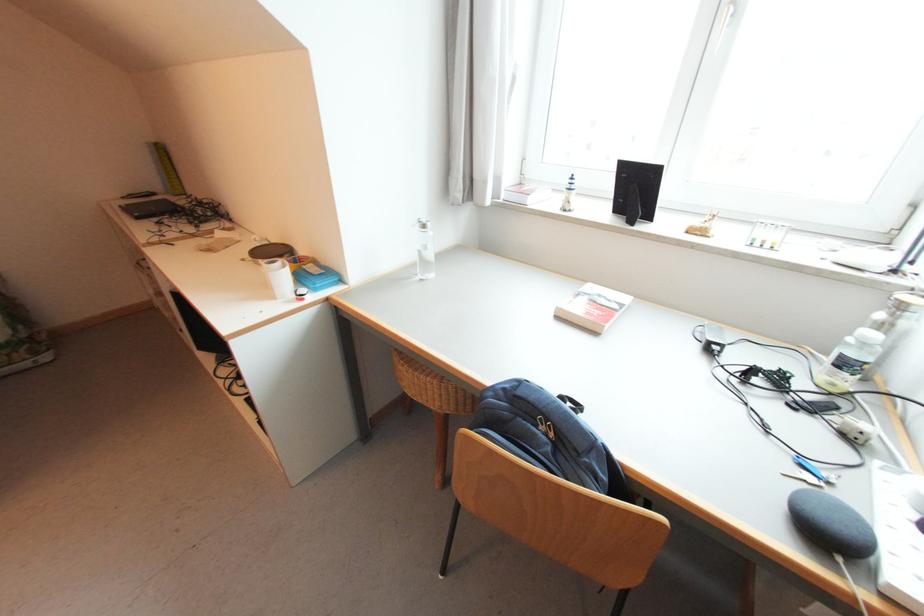
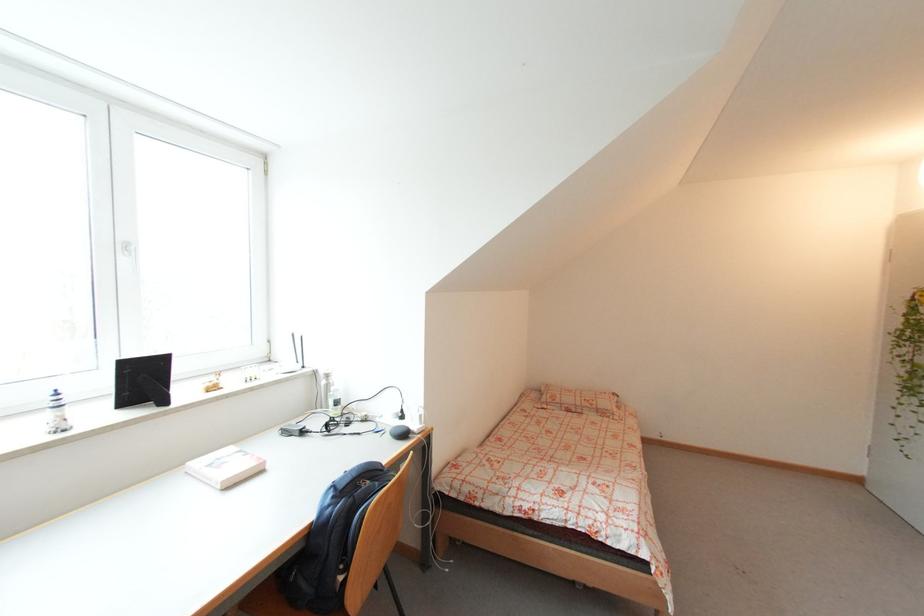
In the second image, find the point that corresponds to point 578,177 in the first image.

(58, 392)